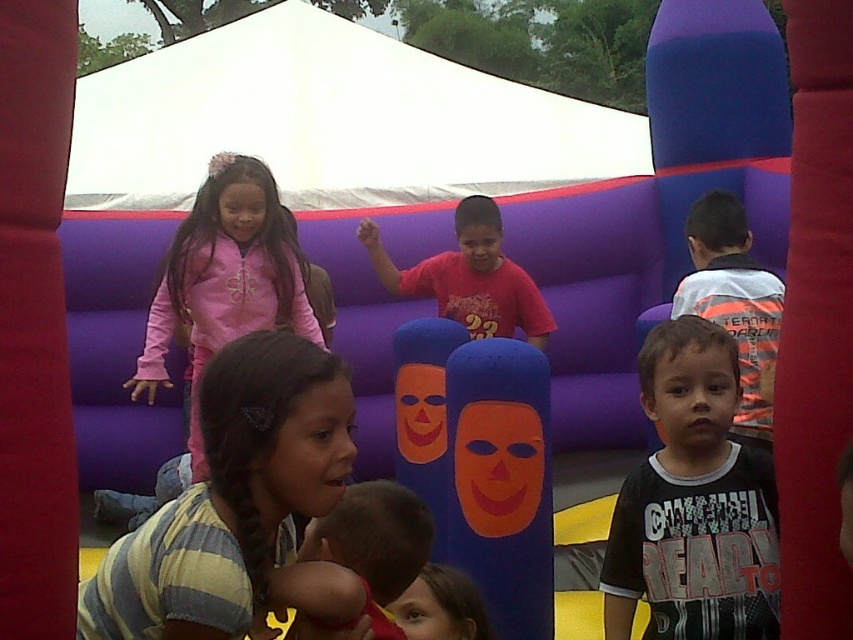
Is striped cotton shirt at center wider than matte red shirt at center?

No, striped cotton shirt at center is not wider than matte red shirt at center.

Is point (181, 637) farther from viewer compared to point (494, 273)?

No, it is in front of (494, 273).

What are the coordinates of `striped cotton shirt at center` in the screenshot? It's located at (231, 497).

Can you confirm if pink fleece jacket at upper left is shorter than matte red shirt at center?

In fact, pink fleece jacket at upper left may be taller than matte red shirt at center.

Is pink fleece jacket at upper left wider than matte red shirt at center?

No, pink fleece jacket at upper left is not wider than matte red shirt at center.

Is point (247, 310) farther from camera compared to point (447, 275)?

No, (247, 310) is closer to viewer.

Find the location of a particular element. Image resolution: width=853 pixels, height=640 pixels. pink fleece jacket at upper left is located at coordinates (225, 280).

Can you confirm if black cotton shirt at lower right is smaller than pink fleece jacket at upper left?

Yes, black cotton shirt at lower right is smaller than pink fleece jacket at upper left.

This screenshot has height=640, width=853. What do you see at coordinates (693, 502) in the screenshot?
I see `black cotton shirt at lower right` at bounding box center [693, 502].

Where is `black cotton shirt at lower right`? The height and width of the screenshot is (640, 853). black cotton shirt at lower right is located at coordinates (693, 502).